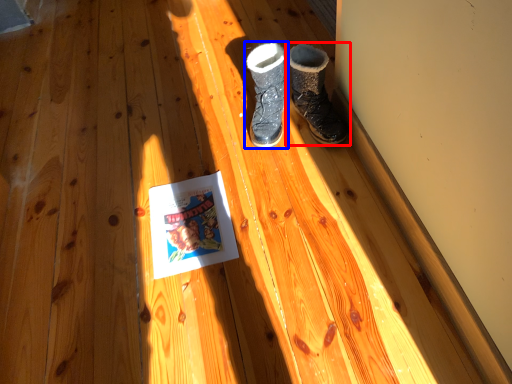
Question: Which point is closer to the camera, footwear (highlighted by a red box) or footwear (highlighted by a blue box)?

Choices:
 (A) footwear
 (B) footwear

Answer: (A)